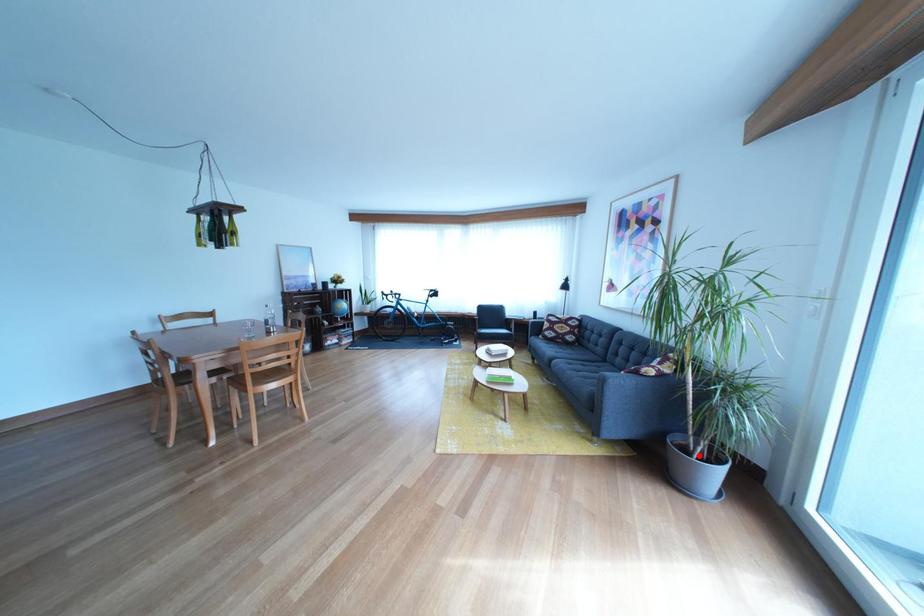
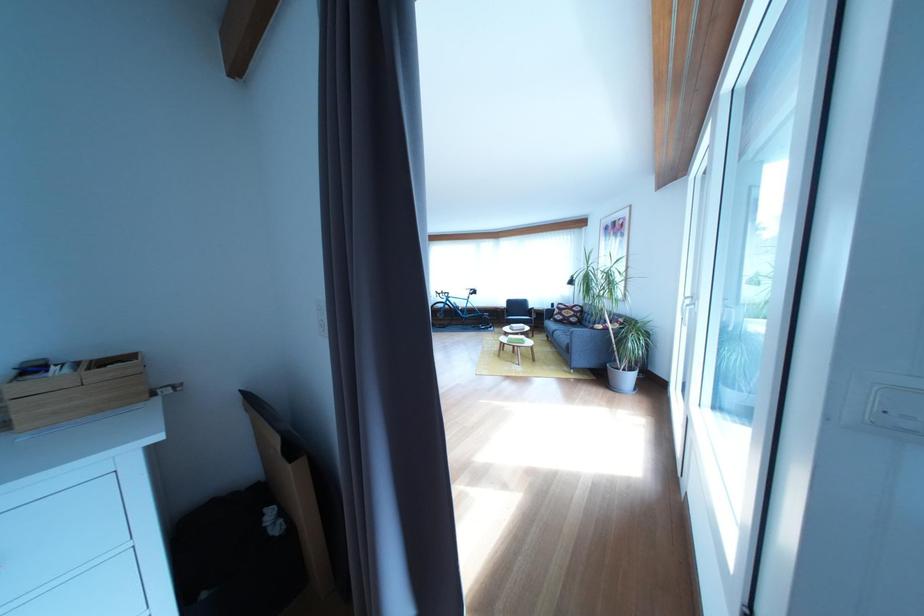
In the second image, find the point that corresponds to the highlighted location in the first image.

(630, 375)